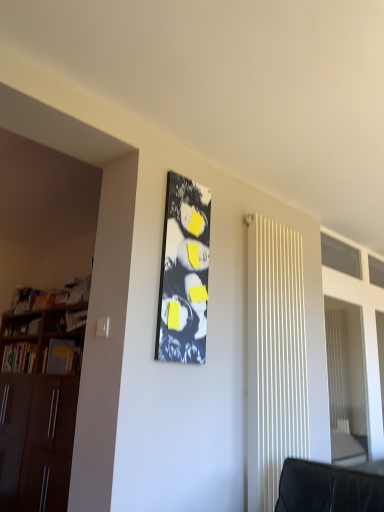
Question: From a real-world perspective, is matte black bulletin board at center below wooden at left?

Choices:
 (A) no
 (B) yes

Answer: (A)

Question: Does matte black bulletin board at center have a greater height compared to wooden at left?

Choices:
 (A) no
 (B) yes

Answer: (B)

Question: Does matte black bulletin board at center have a larger size compared to wooden at left?

Choices:
 (A) yes
 (B) no

Answer: (B)

Question: Is matte black bulletin board at center shorter than wooden at left?

Choices:
 (A) no
 (B) yes

Answer: (A)

Question: Is matte black bulletin board at center oriented away from wooden at left?

Choices:
 (A) yes
 (B) no

Answer: (A)

Question: Considering the positions of point (248, 412) and point (4, 352), is point (248, 412) closer or farther from the camera than point (4, 352)?

Choices:
 (A) closer
 (B) farther

Answer: (A)

Question: Which is correct: white ribbed radiator at right is inside hardcover book at left, or outside of it?

Choices:
 (A) inside
 (B) outside

Answer: (B)

Question: Based on their positions, is white ribbed radiator at right located to the left or right of hardcover book at left?

Choices:
 (A) right
 (B) left

Answer: (A)

Question: From a real-world perspective, is white ribbed radiator at right above or below hardcover book at left?

Choices:
 (A) above
 (B) below

Answer: (A)

Question: Is point (160, 356) closer or farther from the camera than point (3, 371)?

Choices:
 (A) closer
 (B) farther

Answer: (A)

Question: From their relative heights in the image, would you say matte black bulletin board at center is taller or shorter than hardcover book at left?

Choices:
 (A) short
 (B) tall

Answer: (B)

Question: From the image's perspective, relative to hardcover book at left, is matte black bulletin board at center above or below?

Choices:
 (A) above
 (B) below

Answer: (A)

Question: Considering the positions of matte black bulletin board at center and hardcover book at left in the image, is matte black bulletin board at center wider or thinner than hardcover book at left?

Choices:
 (A) thin
 (B) wide

Answer: (A)

Question: From a real-world perspective, is matte black bulletin board at center above or below wooden at left?

Choices:
 (A) above
 (B) below

Answer: (A)

Question: In terms of width, does matte black bulletin board at center look wider or thinner when compared to wooden at left?

Choices:
 (A) wide
 (B) thin

Answer: (B)